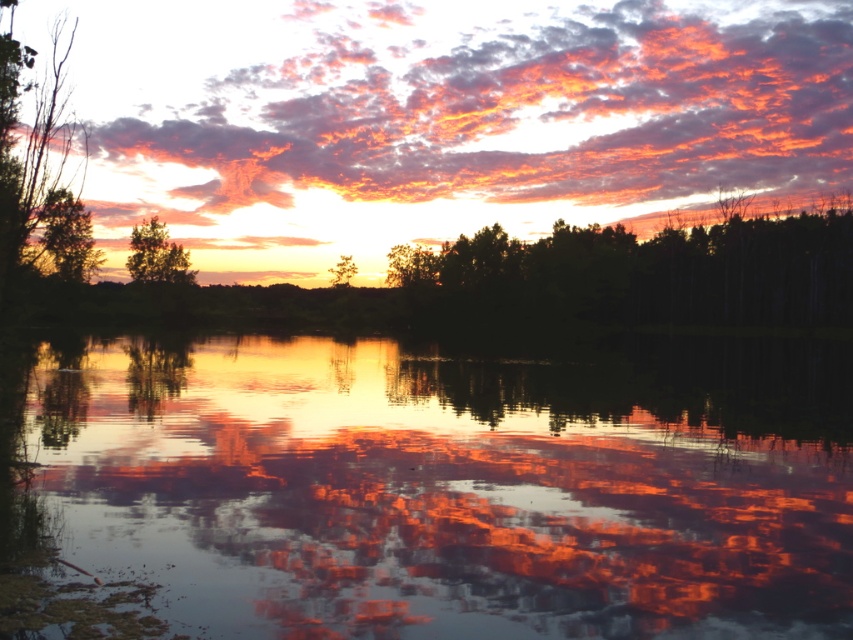
Question: Considering the real-world distances, which object is closest to the silhouette/black trees at center?

Choices:
 (A) silhouette bark tree at left
 (B) glossy reflective water at center
 (C) green matte tree at center

Answer: (C)

Question: Is silhouette/black trees at center to the right of green matte tree at left from the viewer's perspective?

Choices:
 (A) yes
 (B) no

Answer: (A)

Question: Is silhouette/black trees at center closer to the viewer compared to green matte tree at left?

Choices:
 (A) yes
 (B) no

Answer: (B)

Question: Estimate the real-world distances between objects in this image. Which object is closer to the silhouette bark tree at left?

Choices:
 (A) green matte tree at center
 (B) green matte tree at left
 (C) glossy reflective water at center
 (D) cloudy sky at upper center

Answer: (B)

Question: Can you confirm if silhouette bark tree at left is positioned to the left of green matte tree at center?

Choices:
 (A) no
 (B) yes

Answer: (B)

Question: Which of these objects is positioned farthest from the silhouette bark tree at left?

Choices:
 (A) glossy reflective water at center
 (B) green matte tree at upper left
 (C) green matte tree at center

Answer: (C)